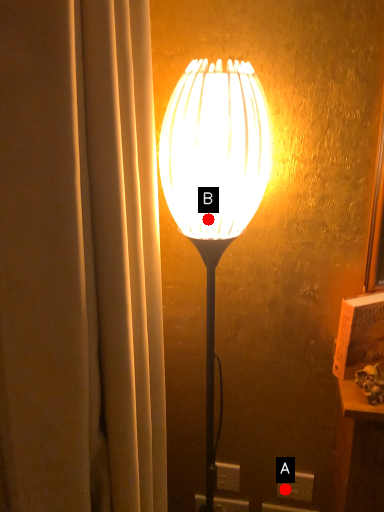
Question: Two points are circled on the image, labeled by A and B beside each circle. Which point is closer to the camera?

Choices:
 (A) A is closer
 (B) B is closer

Answer: (B)